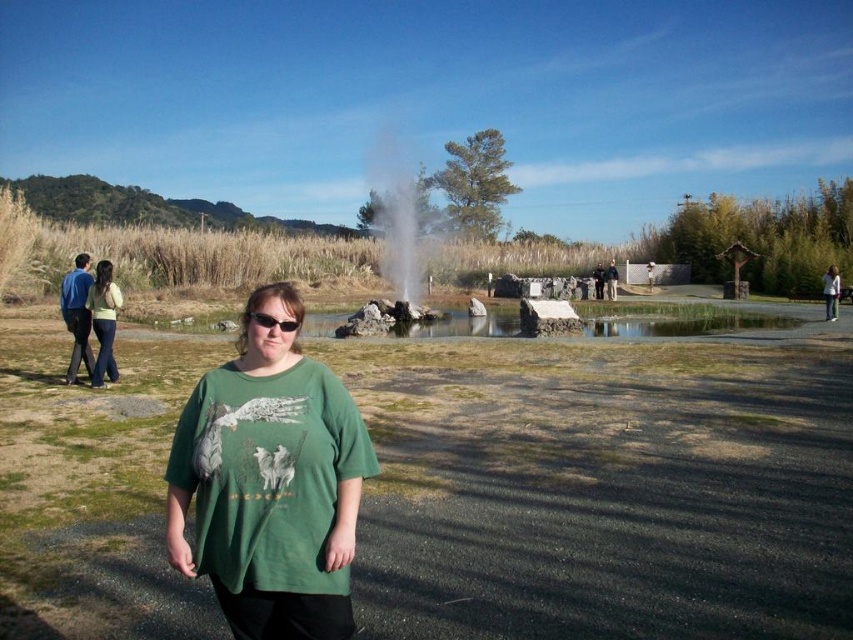
You are standing at the point marked by the coordinates point (602,488) in the image. What object are you currently located at?

The point (602,488) corresponds to the green fabric park at center.